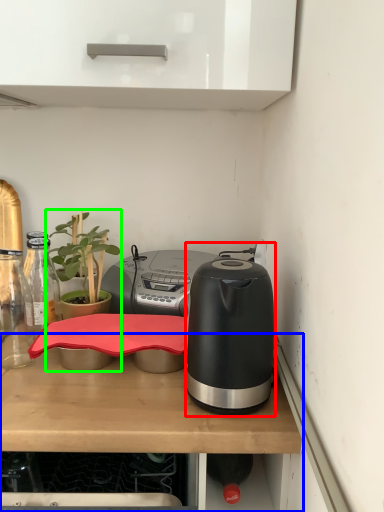
Question: Which object is the farthest from kitchen appliance (highlighted by a red box)? Choose among these: desk (highlighted by a blue box) or houseplant (highlighted by a green box).

Choices:
 (A) desk
 (B) houseplant

Answer: (B)